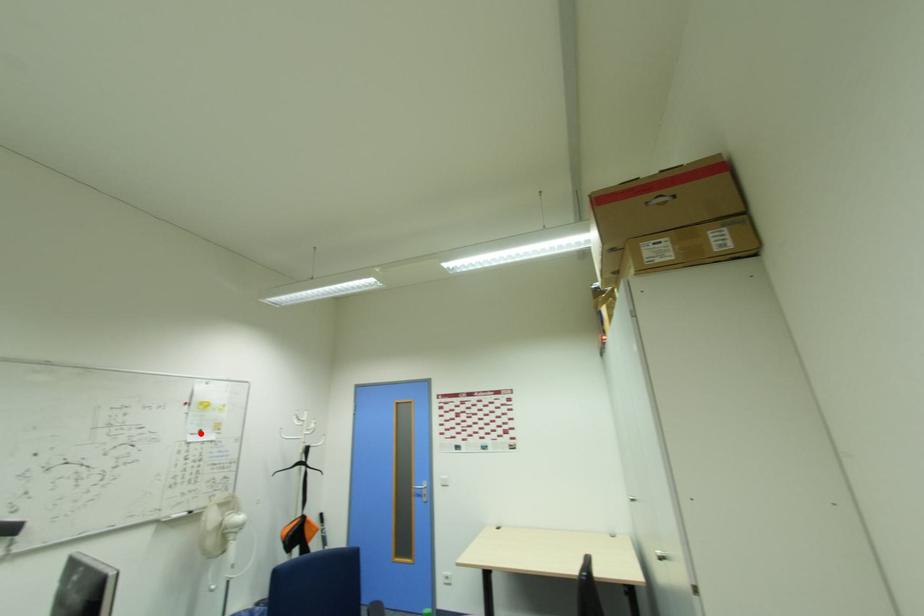
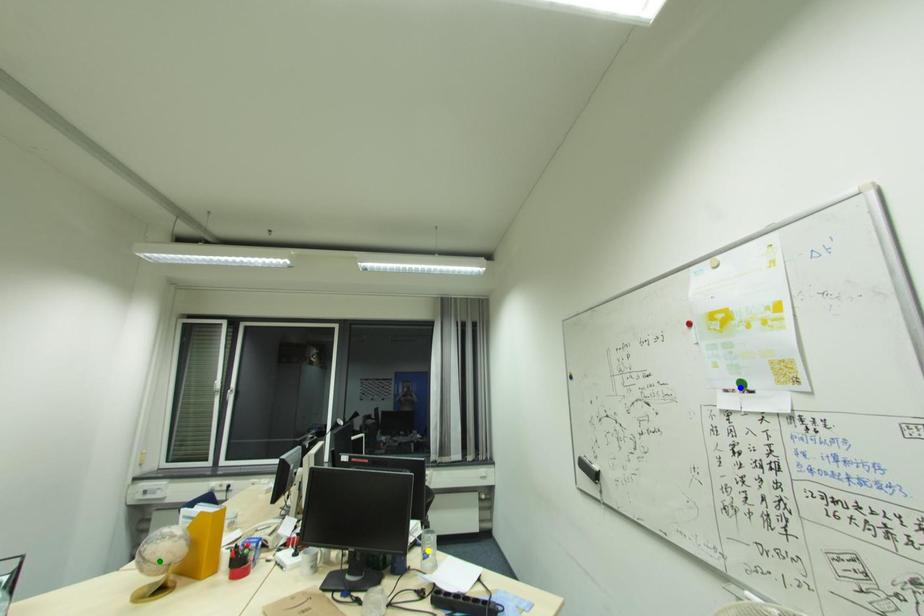
Question: I am providing you with two images of the same scene from different viewpoints. A red point is marked on the first image. You are given multiple points on the second image. Which spot in image 2 lines up with the point in image 1?

Choices:
 (A) blue point
 (B) yellow point
 (C) green point

Answer: (A)